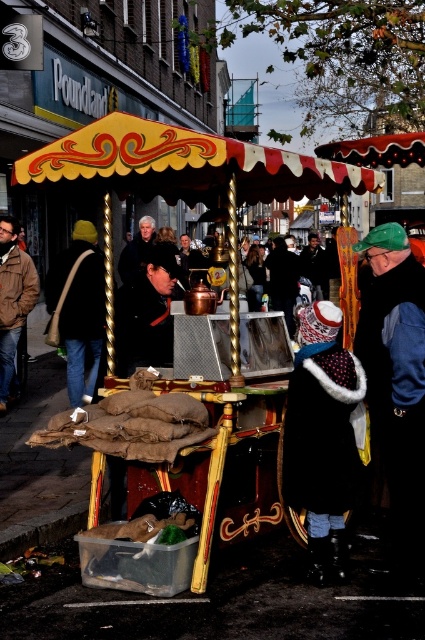
Looking at this image, can you confirm if dark blue jacket at lower right is smaller than brown leather jacket at center?

No.

Is dark blue jacket at lower right bigger than brown leather jacket at center?

Correct, dark blue jacket at lower right is larger in size than brown leather jacket at center.

Where is `dark blue jacket at lower right`? This screenshot has height=640, width=425. dark blue jacket at lower right is located at coordinates (396, 381).

Is black leather jacket at center behind matte black hat at center?

No, it is not.

Does black leather jacket at center have a lesser height compared to matte black hat at center?

Yes, black leather jacket at center is shorter than matte black hat at center.

The image size is (425, 640). What do you see at coordinates (147, 314) in the screenshot? I see `black leather jacket at center` at bounding box center [147, 314].

You are a GUI agent. You are given a task and a screenshot of the screen. Output one action in this format:
    pyautogui.click(x=<x>, y=<y>)
    Task: Click on the black leather jacket at center
    
    Given the screenshot: What is the action you would take?
    pyautogui.click(x=147, y=314)

Can you confirm if dark blue jacket at lower right is bigger than dark brown leather jacket at center?

No, dark blue jacket at lower right is not bigger than dark brown leather jacket at center.

In the scene shown: Which is below, dark blue jacket at lower right or dark brown leather jacket at center?

dark blue jacket at lower right is lower down.

Who is more distant from viewer, (377,420) or (121,276)?

The point (121,276) is behind.

Locate an element on the screen. dark blue jacket at lower right is located at coordinates (396, 381).